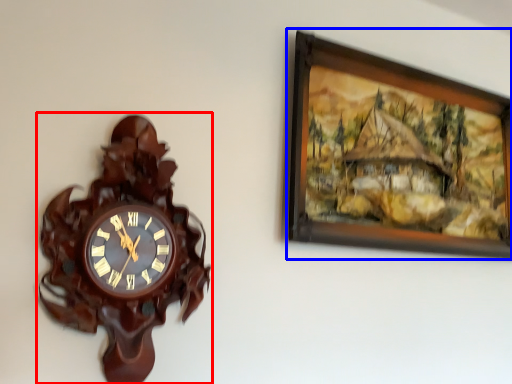
Question: Among these objects, which one is nearest to the camera, wall clock (highlighted by a red box) or picture frame (highlighted by a blue box)?

Choices:
 (A) wall clock
 (B) picture frame

Answer: (A)